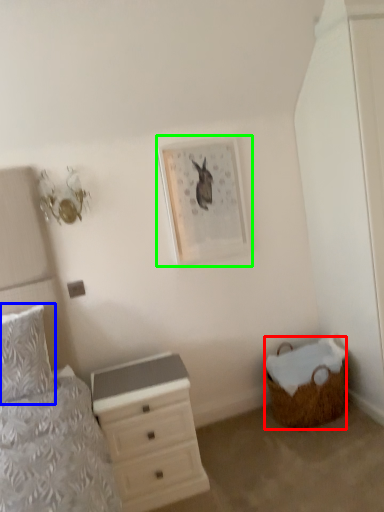
Question: Estimate the real-world distances between objects in this image. Which object is farther from basket (highlighted by a red box), pillow (highlighted by a blue box) or picture frame (highlighted by a green box)?

Choices:
 (A) pillow
 (B) picture frame

Answer: (A)